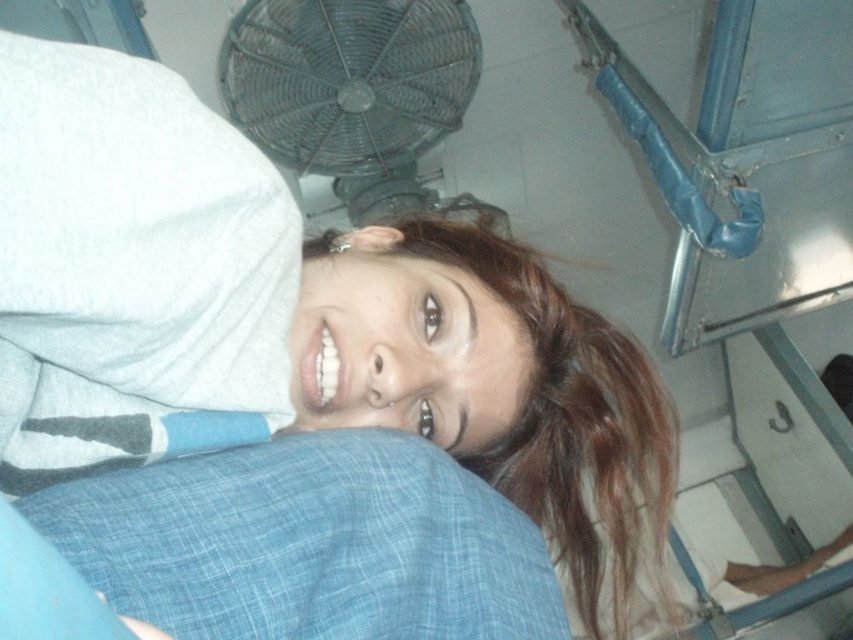
Can you confirm if smooth brown hair at center is positioned to the left of metallic wire mesh fan at upper center?

Incorrect, smooth brown hair at center is not on the left side of metallic wire mesh fan at upper center.

Does smooth brown hair at center appear under metallic wire mesh fan at upper center?

Yes, smooth brown hair at center is below metallic wire mesh fan at upper center.

Find the location of `smooth brown hair at center`. smooth brown hair at center is located at coordinates (570, 419).